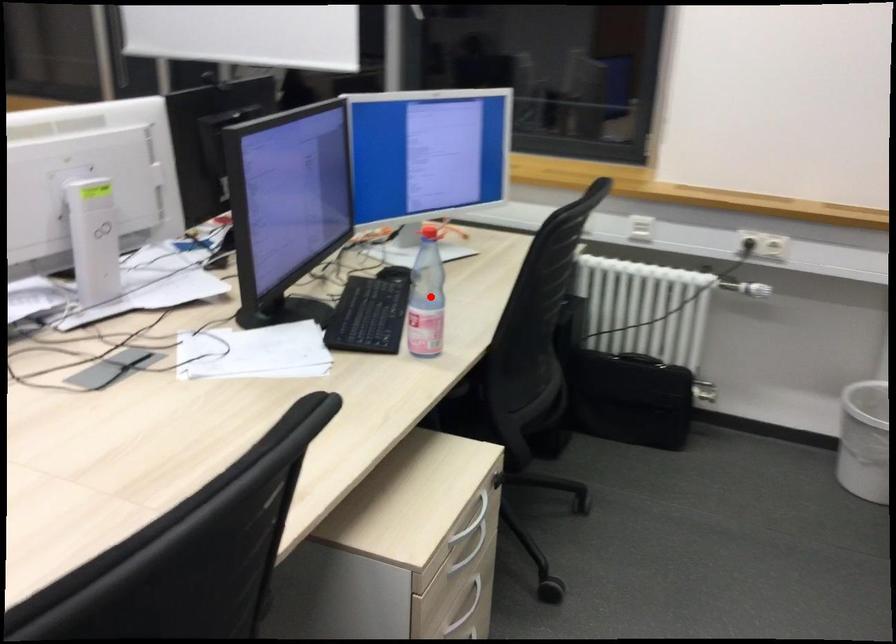
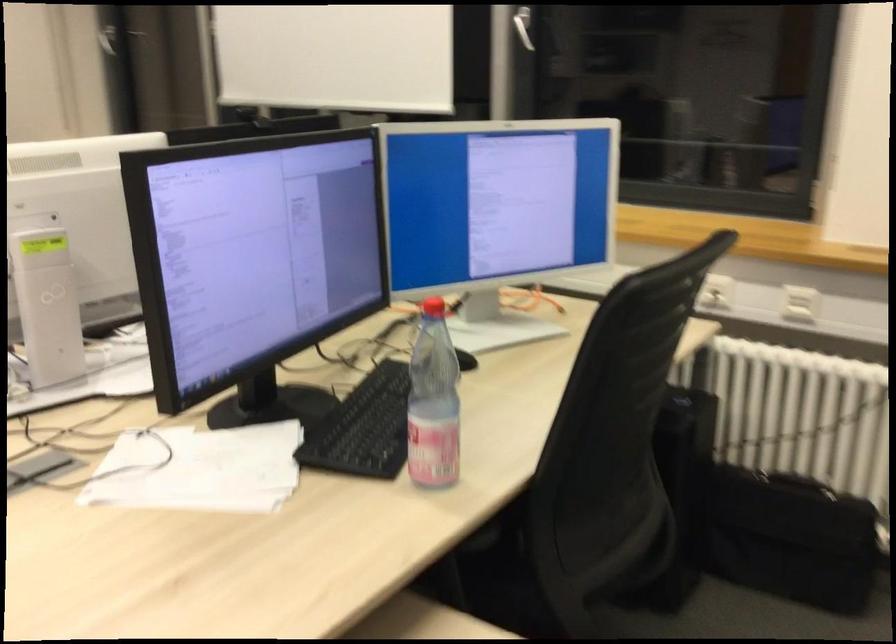
Find the pixel in the second image that matches the highlighted location in the first image.

(433, 402)